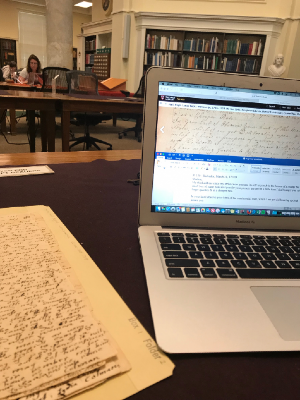
The width and height of the screenshot is (300, 400). Identify the location of clock. (106, 6).